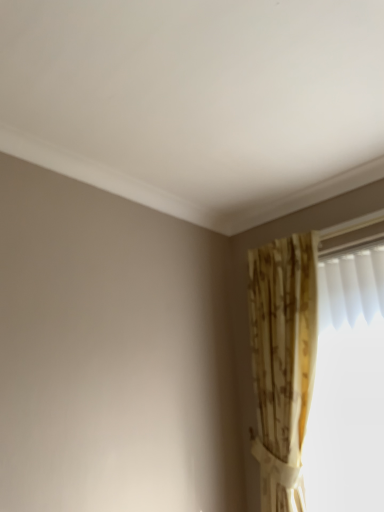
What do you see at coordinates (283, 362) in the screenshot? This screenshot has width=384, height=512. I see `beige floral fabric curtain at right` at bounding box center [283, 362].

At what (x,y) coordinates should I click in order to perform the action: click on beige floral fabric curtain at right. Please return your answer as a coordinate pair (x, y). The height and width of the screenshot is (512, 384). Looking at the image, I should click on (283, 362).

Locate an element on the screen. The image size is (384, 512). beige floral fabric curtain at right is located at coordinates (283, 362).